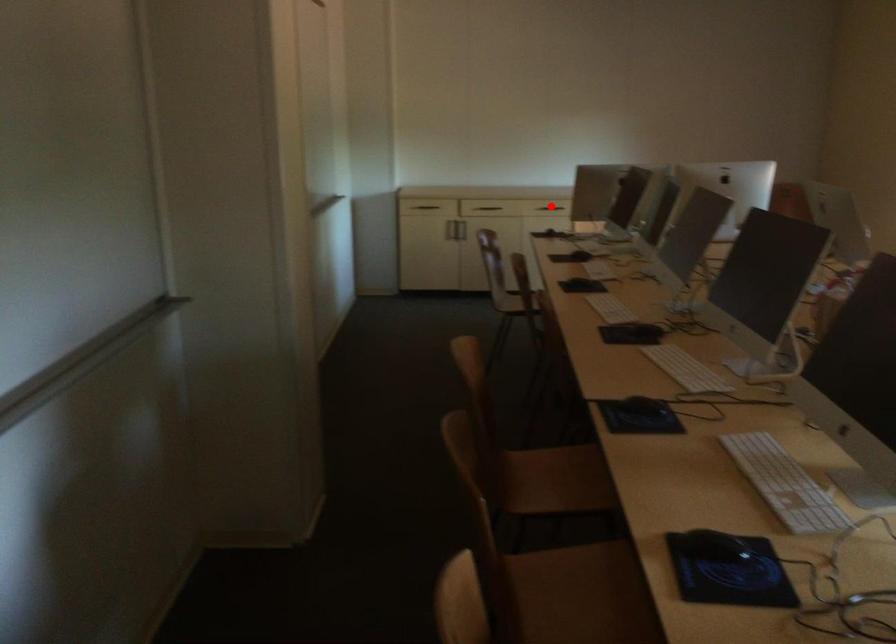
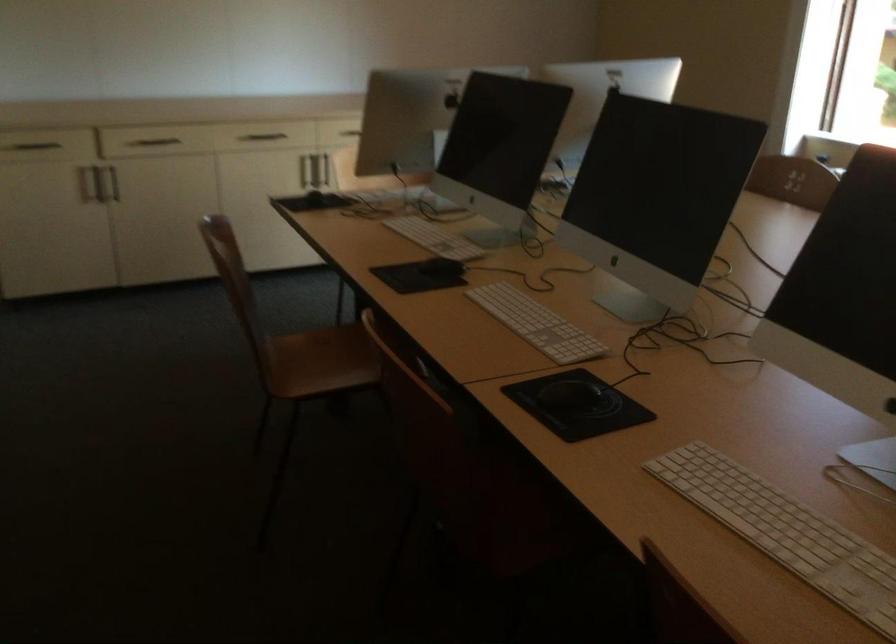
Question: I am providing you with two images of the same scene from different viewpoints. A red point is marked on the first image. At the location where the point appears in image 1, is it still visible in image 2?

Choices:
 (A) Yes
 (B) No

Answer: (B)